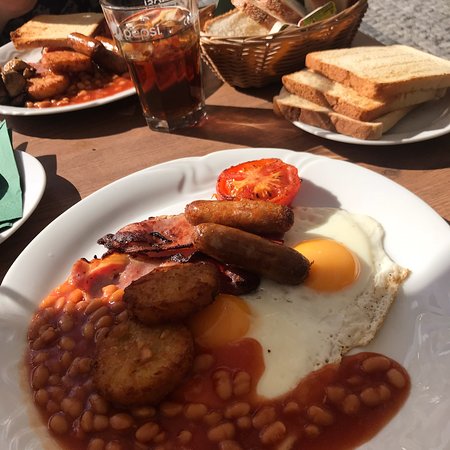
The height and width of the screenshot is (450, 450). I want to click on table, so click(113, 151).